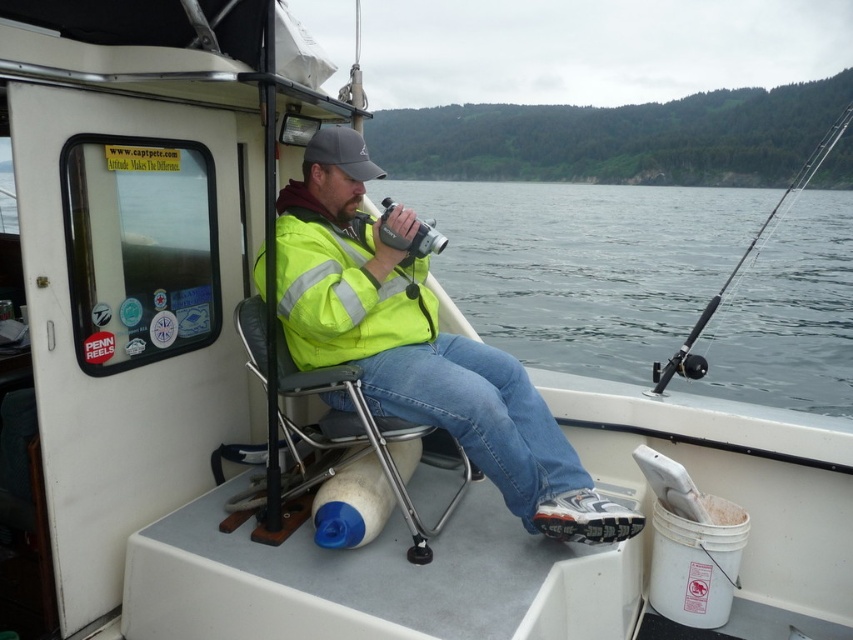
Question: Which point is farther to the camera?

Choices:
 (A) gray water at center
 (B) metallic gray chair at center

Answer: (A)

Question: Considering the relative positions of gray water at center and yellow reflective jacket at center in the image provided, where is gray water at center located with respect to yellow reflective jacket at center?

Choices:
 (A) right
 (B) left

Answer: (A)

Question: Observing the image, what is the correct spatial positioning of yellow reflective jacket at center in reference to metallic gray chair at center?

Choices:
 (A) above
 (B) below

Answer: (A)

Question: Does gray water at center appear under black plastic fishing pole at right?

Choices:
 (A) no
 (B) yes

Answer: (B)

Question: Estimate the real-world distances between objects in this image. Which object is farther from the gray water at center?

Choices:
 (A) metallic gray chair at center
 (B) yellow reflective jacket at center
 (C) black plastic fishing pole at right

Answer: (A)

Question: Which object appears closest to the camera in this image?

Choices:
 (A) metallic gray chair at center
 (B) yellow reflective jacket at center
 (C) gray water at center

Answer: (A)